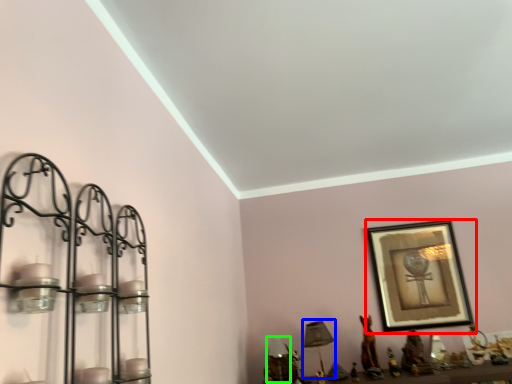
Question: Based on their relative distances, which object is farther from picture frame (highlighted by a red box)? Choose from table lamp (highlighted by a blue box) and table lamp (highlighted by a green box).

Choices:
 (A) table lamp
 (B) table lamp

Answer: (B)